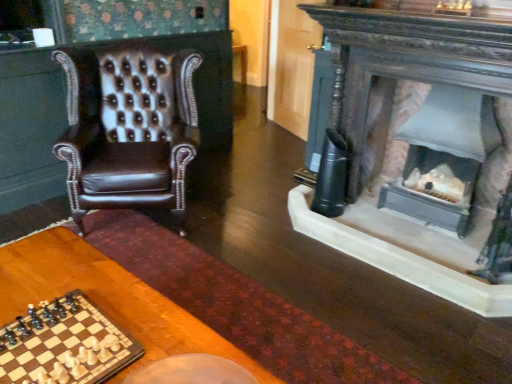
You are a GUI agent. You are given a task and a screenshot of the screen. Output one action in this format:
    pyautogui.click(x=<x>, y=<y>)
    Task: Click on the wooden table at lower left
    This screenshot has height=384, width=512.
    Given the screenshot: What is the action you would take?
    pyautogui.click(x=108, y=299)

This screenshot has height=384, width=512. What do you see at coordinates (108, 299) in the screenshot?
I see `wooden table at lower left` at bounding box center [108, 299].

What do you see at coordinates (128, 128) in the screenshot?
I see `brown leather chair at left` at bounding box center [128, 128].

Locate an element on the screen. wooden chessboard at lower left is located at coordinates (64, 344).

From the image's perspective, which is above, wooden table at lower left or brown leather chair at left?

brown leather chair at left appears higher in the image.

Can you confirm if wooden table at lower left is smaller than brown leather chair at left?

Indeed, wooden table at lower left has a smaller size compared to brown leather chair at left.

Which point is more forward, (11,283) or (130,60)?

The point (11,283) is closer to the camera.

Looking at this image, based on their positions, is wooden chessboard at lower left located to the left or right of brown leather chair at left?

From the image, it's evident that wooden chessboard at lower left is to the right of brown leather chair at left.

Is wooden chessboard at lower left positioned beyond the bounds of brown leather chair at left?

That's correct, wooden chessboard at lower left is outside of brown leather chair at left.

Can you tell me how much wooden chessboard at lower left and brown leather chair at left differ in facing direction?

The facing directions of wooden chessboard at lower left and brown leather chair at left are 132 degrees apart.

Is wooden chessboard at lower left not near brown leather chair at left?

Yes, wooden chessboard at lower left is far from brown leather chair at left.

Is wooden table at lower left at the back of brown leather chair at left?

No, brown leather chair at left is not facing away from wooden table at lower left.

Consider the image. Is brown leather chair at left taller than wooden table at lower left?

Indeed, brown leather chair at left has a greater height compared to wooden table at lower left.

Can you confirm if brown leather chair at left is positioned to the right of wooden table at lower left?

No, brown leather chair at left is not to the right of wooden table at lower left.

Who is smaller, brown leather chair at left or wooden table at lower left?

wooden table at lower left is smaller.

From the image's perspective, would you say brown leather chair at left is shown under wooden chessboard at lower left?

No.

From a real-world perspective, is brown leather chair at left on wooden chessboard at lower left?

No.

Is brown leather chair at left to the left of wooden chessboard at lower left from the viewer's perspective?

Yes.

How far apart are brown leather chair at left and wooden chessboard at lower left?

brown leather chair at left is 4.96 feet from wooden chessboard at lower left.

From a real-world perspective, does wooden chessboard at lower left stand above wooden table at lower left?

Yes.

Is wooden chessboard at lower left looking in the opposite direction of wooden table at lower left?

wooden chessboard at lower left does not have its back to wooden table at lower left.

Is wooden chessboard at lower left smaller than wooden table at lower left?

Yes.

Which is more to the right, wooden table at lower left or wooden chessboard at lower left?

wooden table at lower left is more to the right.

From the image's perspective, is wooden table at lower left under wooden chessboard at lower left?

Yes, from the image's perspective, wooden table at lower left is below wooden chessboard at lower left.

Can you confirm if wooden table at lower left is smaller than wooden chessboard at lower left?

No.

From the picture: Is wooden table at lower left not close to wooden chessboard at lower left?

That's not correct — wooden table at lower left is a little close to wooden chessboard at lower left.

Where is `table that appears below the brown leather chair at left (from the image's perspective)`? Image resolution: width=512 pixels, height=384 pixels. table that appears below the brown leather chair at left (from the image's perspective) is located at coordinates (108, 299).

This screenshot has height=384, width=512. In the image, there is a wooden chessboard at lower left. Find the location of `chair above it (from the image's perspective)`. chair above it (from the image's perspective) is located at coordinates (128, 128).

Considering their positions, is wooden chessboard at lower left positioned further to wooden table at lower left than brown leather chair at left?

Among the two, brown leather chair at left is located further to wooden table at lower left.

Based on their spatial positions, is wooden chessboard at lower left or wooden table at lower left further from brown leather chair at left?

wooden chessboard at lower left lies further to brown leather chair at left than the other object.

From the picture: When comparing their distances from wooden chessboard at lower left, does brown leather chair at left or wooden table at lower left seem closer?

wooden table at lower left lies closer to wooden chessboard at lower left than the other object.

Considering their positions, is wooden table at lower left positioned closer to wooden chessboard at lower left than brown leather chair at left?

Among the two, wooden table at lower left is located nearer to wooden chessboard at lower left.

Looking at the image, which one is located further to wooden table at lower left, brown leather chair at left or wooden chessboard at lower left?

Among the two, brown leather chair at left is located further to wooden table at lower left.

When comparing their distances from brown leather chair at left, does wooden table at lower left or wooden chessboard at lower left seem further?

wooden chessboard at lower left is further to brown leather chair at left.

The image size is (512, 384). In order to click on board game between wooden table at lower left and brown leather chair at left in the front-back direction in this screenshot , I will do `click(64, 344)`.